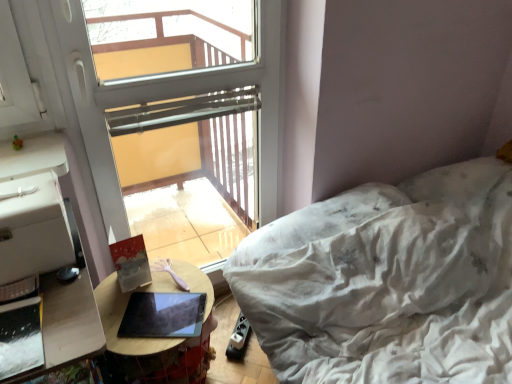
Where is `vacant space underneath matte black tablet at center (from a real-world perspective)`? vacant space underneath matte black tablet at center (from a real-world perspective) is located at coordinates (165, 316).